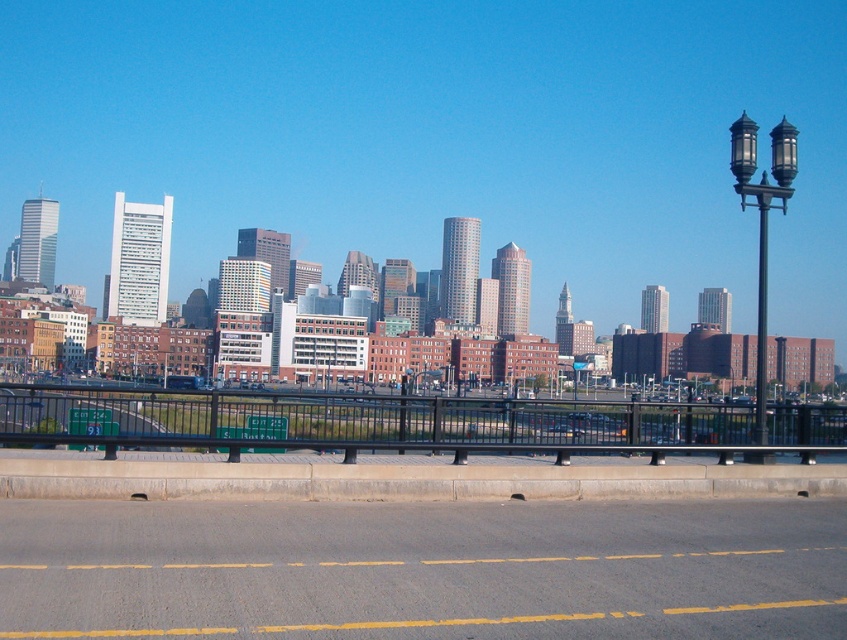
You are a delivery drone flying above the city. You need to land on the yellow asphalt road at lower center. However, there is a black metal fence at lower center in the way. Can you safely land on the road without hitting the fence?

The yellow asphalt road at lower center is positioned under the black metal fence at lower center, so the drone can safely land on the road as the fence is above it and won not obstruct the landing area.

You are a delivery drone flying over the city. You need to land on the yellow asphalt road at lower center. What coordinates should you aim for?

The yellow asphalt road at lower center is located at coordinates point (424, 570), so you should aim for those coordinates to land safely.